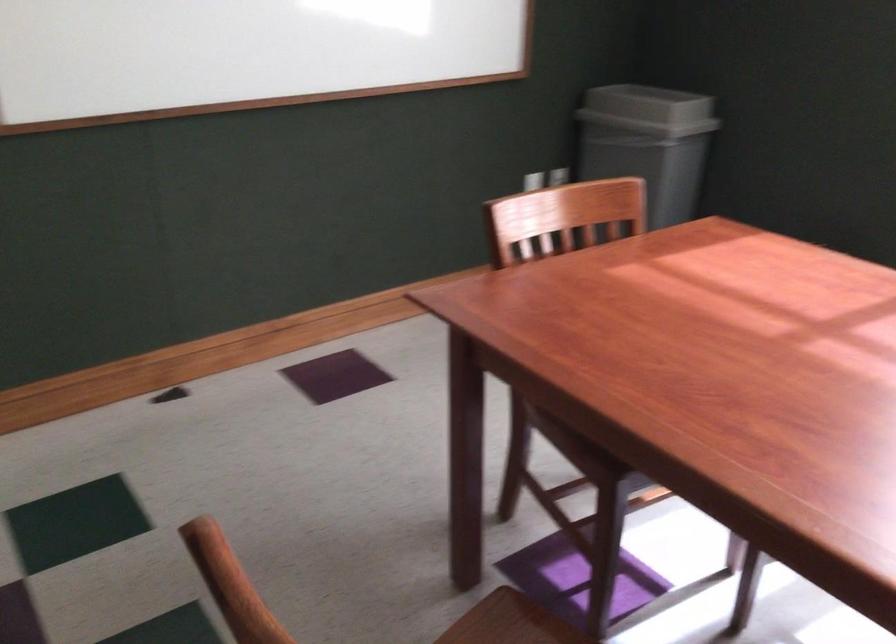
In order to click on gray trash can lid in this screenshot , I will do coord(648,109).